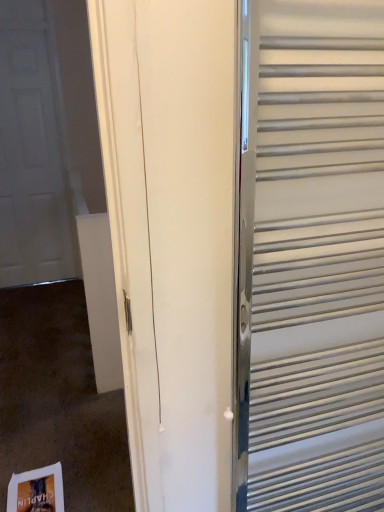
This screenshot has width=384, height=512. I want to click on empty space that is ontop of white matte door at left (from a real-world perspective), so click(18, 35).